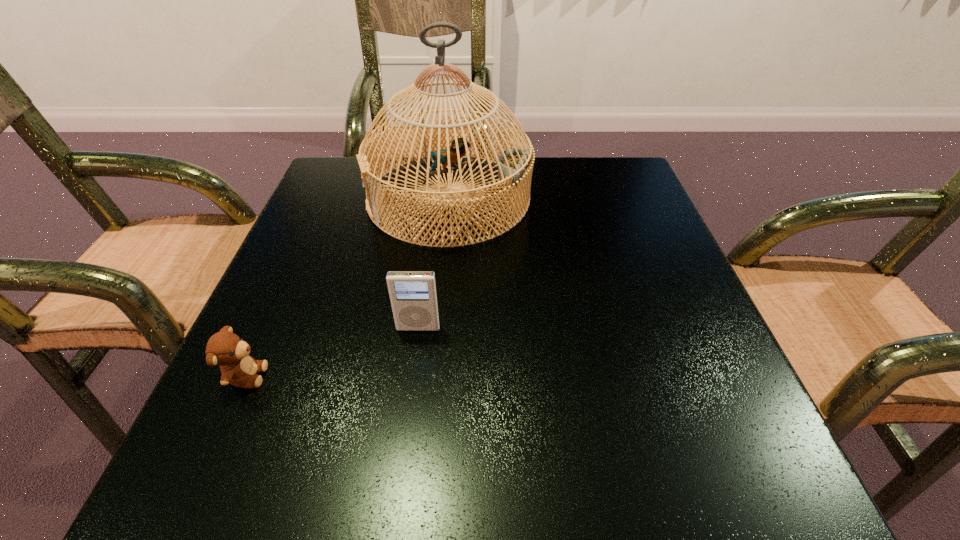
At what (x,y) coordinates should I click in order to perform the action: click on object that stands as the closest to the birdcage. Please return your answer as a coordinate pair (x, y). This screenshot has width=960, height=540. Looking at the image, I should click on tap(413, 294).

Find the location of a particular element. vacant area in the image that satisfies the following two spatial constraints: 1. on the front-facing side of the second nearest object; 2. on the face of the nearest object is located at coordinates (412, 376).

Where is `vacant space that satisfies the following two spatial constraints: 1. on the front-facing side of the second shortest object; 2. on the face of the nearest object`? vacant space that satisfies the following two spatial constraints: 1. on the front-facing side of the second shortest object; 2. on the face of the nearest object is located at coordinates (412, 376).

Identify the location of free space that satisfies the following two spatial constraints: 1. on the front-facing side of the iPod; 2. on the face of the nearest object. The height and width of the screenshot is (540, 960). [x=412, y=376].